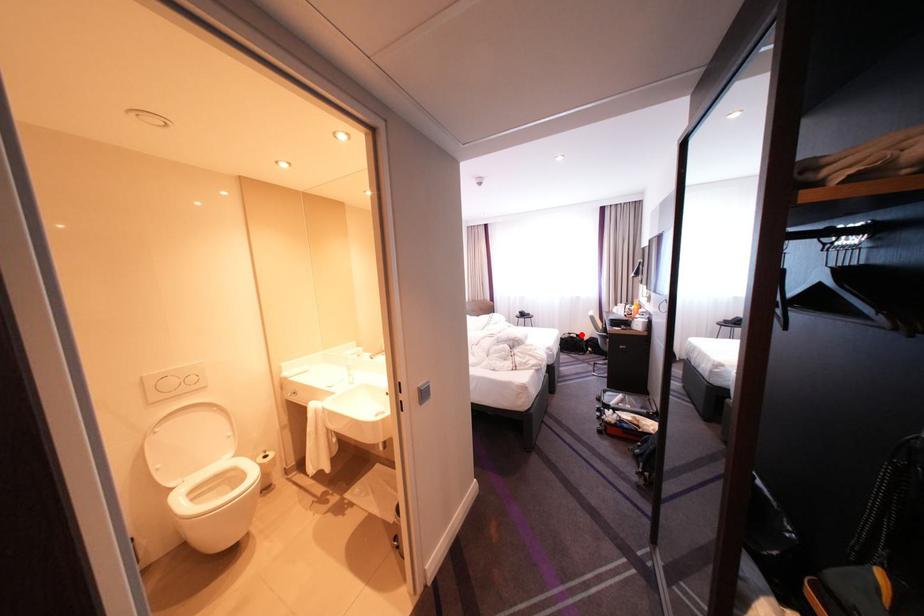
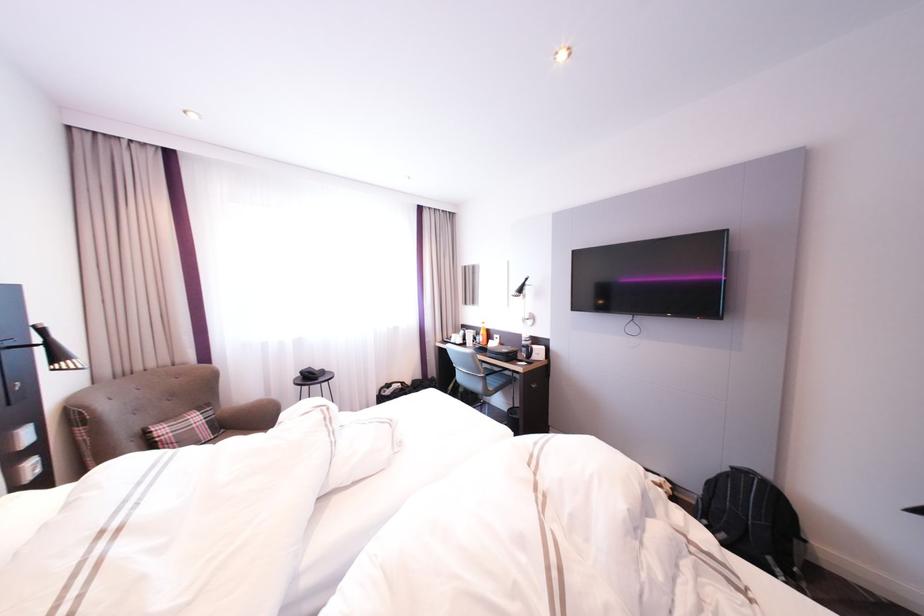
Locate, in the second image, the point that corresponds to the highlighted location in the first image.

(400, 386)